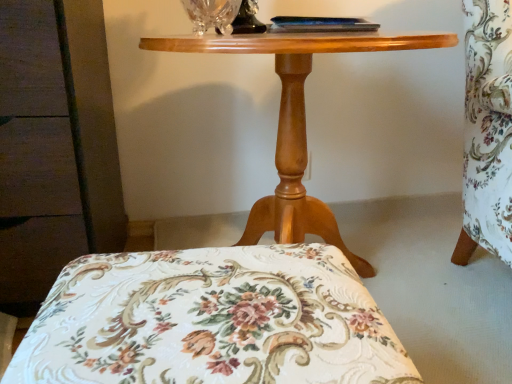
Question: From a real-world perspective, is wooden table at center under transparent crystal vase at upper center?

Choices:
 (A) yes
 (B) no

Answer: (A)

Question: Is the depth of wooden table at center less than that of transparent crystal vase at upper center?

Choices:
 (A) yes
 (B) no

Answer: (A)

Question: Is wooden table at center further to camera compared to transparent crystal vase at upper center?

Choices:
 (A) yes
 (B) no

Answer: (B)

Question: From a real-world perspective, is wooden table at center on top of transparent crystal vase at upper center?

Choices:
 (A) yes
 (B) no

Answer: (B)

Question: Is wooden table at center smaller than transparent crystal vase at upper center?

Choices:
 (A) no
 (B) yes

Answer: (A)

Question: Considering the positions of clear glass table lamp at upper center and transparent crystal vase at upper center in the image, is clear glass table lamp at upper center taller or shorter than transparent crystal vase at upper center?

Choices:
 (A) short
 (B) tall

Answer: (B)

Question: Considering the positions of point (239, 29) and point (196, 26), is point (239, 29) closer or farther from the camera than point (196, 26)?

Choices:
 (A) closer
 (B) farther

Answer: (B)

Question: From the image's perspective, is clear glass table lamp at upper center above or below transparent crystal vase at upper center?

Choices:
 (A) below
 (B) above

Answer: (B)

Question: From a real-world perspective, is clear glass table lamp at upper center physically located above or below transparent crystal vase at upper center?

Choices:
 (A) above
 (B) below

Answer: (A)

Question: Looking at the image, does clear glass table lamp at upper center seem bigger or smaller compared to floral fabric cushion at center?

Choices:
 (A) small
 (B) big

Answer: (A)

Question: Is clear glass table lamp at upper center wider or thinner than floral fabric cushion at center?

Choices:
 (A) thin
 (B) wide

Answer: (A)

Question: Do you think clear glass table lamp at upper center is within floral fabric cushion at center, or outside of it?

Choices:
 (A) inside
 (B) outside

Answer: (B)

Question: Would you say clear glass table lamp at upper center is to the left or to the right of floral fabric cushion at center in the picture?

Choices:
 (A) left
 (B) right

Answer: (B)

Question: Based on their sizes in the image, would you say floral fabric cushion at center is bigger or smaller than transparent crystal vase at upper center?

Choices:
 (A) big
 (B) small

Answer: (A)

Question: Considering the positions of floral fabric cushion at center and transparent crystal vase at upper center in the image, is floral fabric cushion at center taller or shorter than transparent crystal vase at upper center?

Choices:
 (A) short
 (B) tall

Answer: (B)